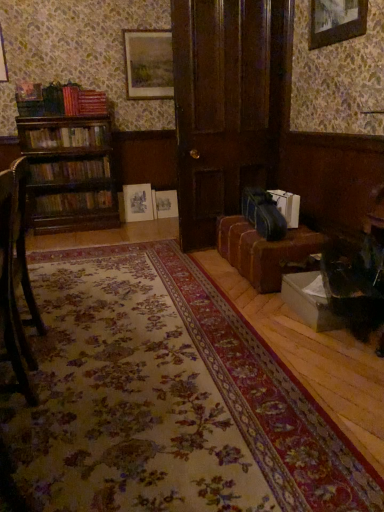
Locate an element on the screen. Image resolution: width=384 pixels, height=512 pixels. vacant area that is situated to the right of wooden chair at left is located at coordinates (95, 346).